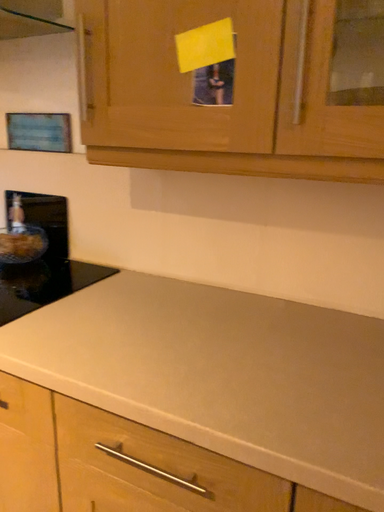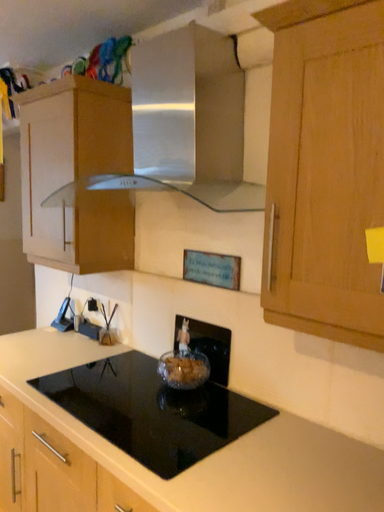
Question: Which way did the camera rotate in the video?

Choices:
 (A) rotated right
 (B) rotated left

Answer: (B)